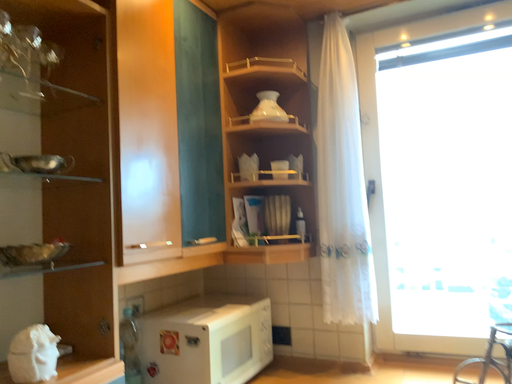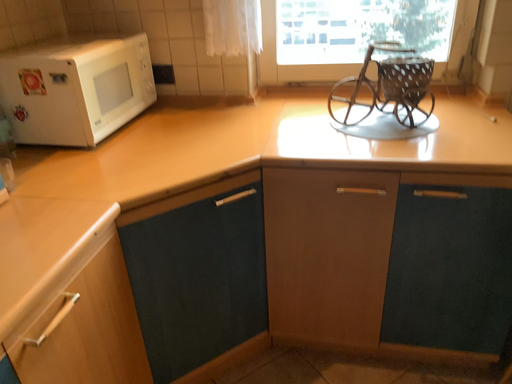
Question: How did the camera likely rotate when shooting the video?

Choices:
 (A) rotated downward
 (B) rotated upward

Answer: (A)